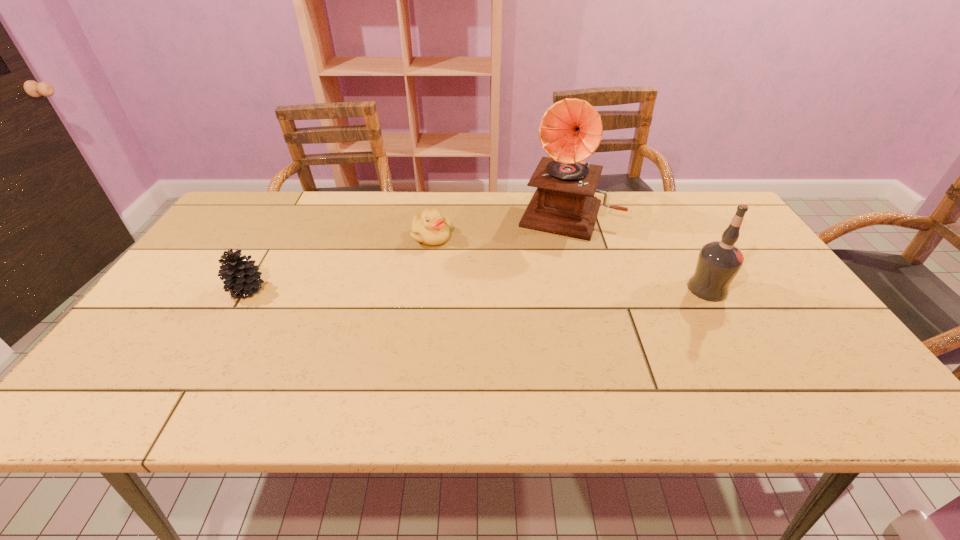
Identify the location of pinecone. point(242,278).

Where is `the second shortest object`? This screenshot has width=960, height=540. the second shortest object is located at coordinates [242, 278].

Locate an element on the screen. the third shortest object is located at coordinates (718, 263).

Where is `vodka`? The image size is (960, 540). vodka is located at coordinates (718, 263).

What are the coordinates of `the tallest object` in the screenshot? It's located at (570, 131).

Locate an element on the screen. This screenshot has height=540, width=960. the third object from left to right is located at coordinates (570, 131).

Find the location of a particular element. The height and width of the screenshot is (540, 960). duckling is located at coordinates (430, 228).

The image size is (960, 540). What are the coordinates of `the third object from right to left` in the screenshot? It's located at (430, 228).

Locate an element on the screen. The image size is (960, 540). vacant area located 0.310m on the back of the pinecone is located at coordinates (291, 214).

Find the location of `vacant space situated 0.070m on the front label of the rightmost object`. vacant space situated 0.070m on the front label of the rightmost object is located at coordinates (754, 289).